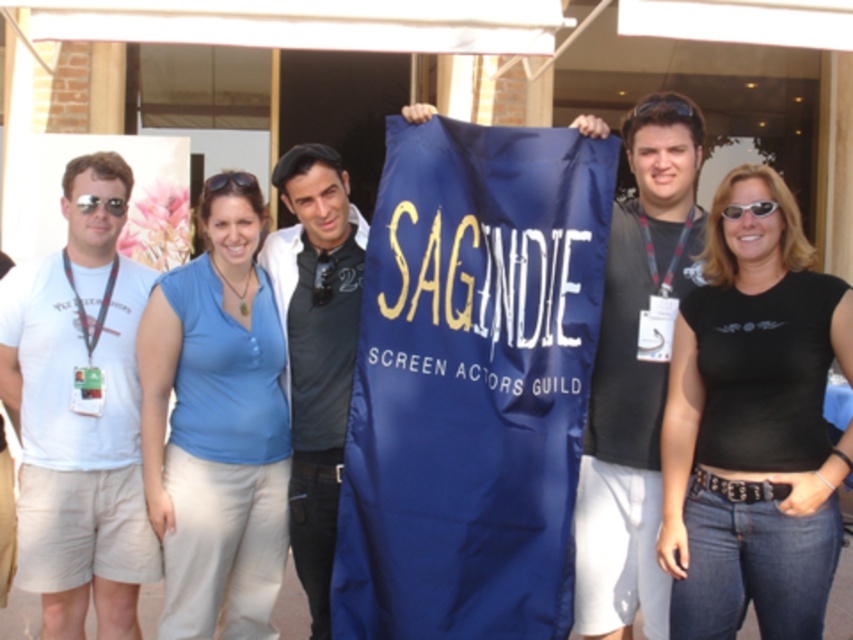
How distant is black cotton shirt at center from blue fabric shirt at center?

black cotton shirt at center and blue fabric shirt at center are 7.00 feet apart from each other.

Who is positioned more to the right, black cotton shirt at center or blue fabric shirt at center?

From the viewer's perspective, black cotton shirt at center appears more on the right side.

Between point (831, 304) and point (196, 472), which one is positioned in front?

Point (831, 304)

You are a GUI agent. You are given a task and a screenshot of the screen. Output one action in this format:
    pyautogui.click(x=<x>, y=<y>)
    Task: Click on the black cotton shirt at center
    
    Given the screenshot: What is the action you would take?
    pyautogui.click(x=753, y=426)

Does white cotton t-shirt at left appear under white plastic sunglasses at center?

Yes, white cotton t-shirt at left is below white plastic sunglasses at center.

Is point (106, 288) positioned behind point (750, 205)?

Yes, it is behind point (750, 205).

Who is more forward, [51,273] or [757,205]?

Point [757,205] is more forward.

The width and height of the screenshot is (853, 640). Find the location of `white cotton t-shirt at left`. white cotton t-shirt at left is located at coordinates (80, 413).

Which is below, matte black shirt at center or black plastic goggles at upper center?

matte black shirt at center is lower down.

Is matte black shirt at center to the left of black plastic goggles at upper center from the viewer's perspective?

In fact, matte black shirt at center is to the right of black plastic goggles at upper center.

Find the location of a particular element. matte black shirt at center is located at coordinates (635, 372).